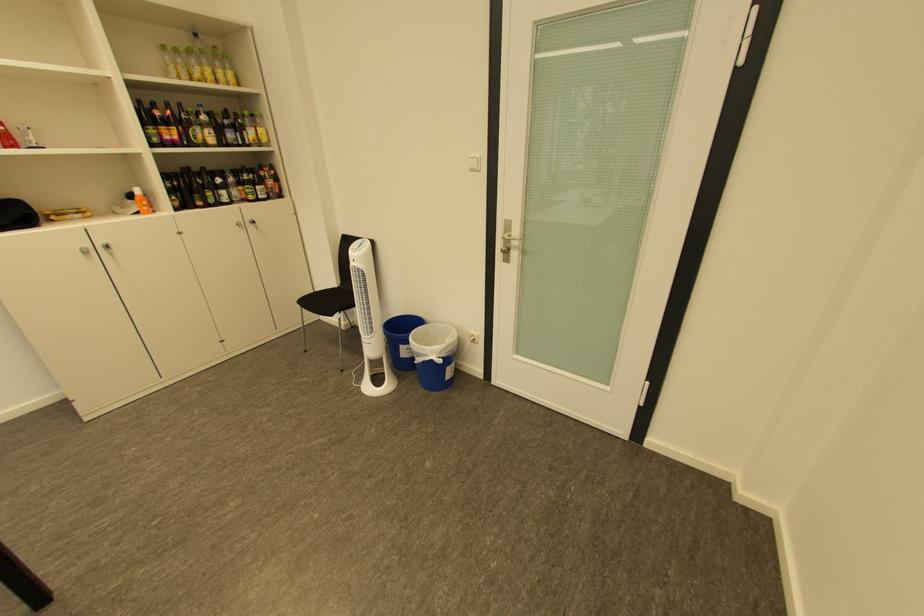
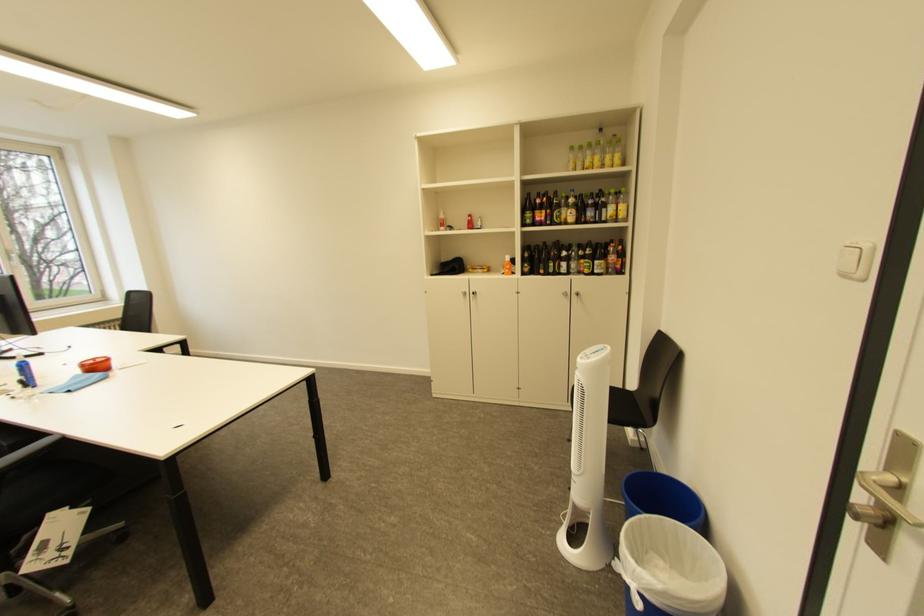
Where in the second image is the point corresponding to [514,235] from the first image?

(898, 472)